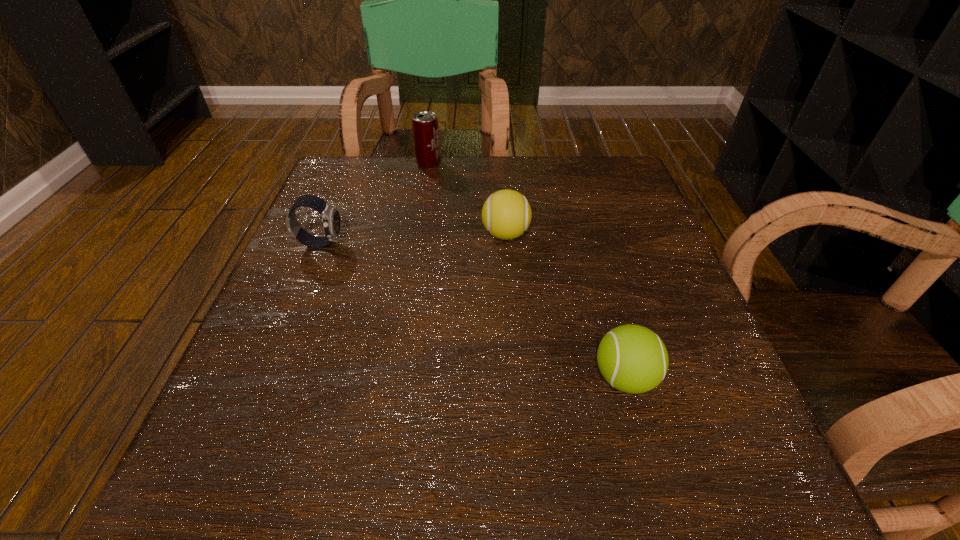
What are the coordinates of `beer can` in the screenshot? It's located at pos(425,127).

At what (x,y) coordinates should I click in order to perform the action: click on the farthest object. Please return your answer as a coordinate pair (x, y). This screenshot has height=540, width=960. Looking at the image, I should click on (425, 127).

Where is `the leftmost object`? Image resolution: width=960 pixels, height=540 pixels. the leftmost object is located at coordinates (330, 215).

Find the location of a particular element. the left tennis ball is located at coordinates (506, 214).

You are a GUI agent. You are given a task and a screenshot of the screen. Output one action in this format:
    pyautogui.click(x=<x>, y=<y>)
    Task: Click on the farther tennis ball
    This screenshot has width=960, height=540.
    Given the screenshot: What is the action you would take?
    pos(506,214)

The width and height of the screenshot is (960, 540). What are the coordinates of `the rightmost object` in the screenshot? It's located at (633, 359).

At what (x,y) coordinates should I click in order to perform the action: click on the nearest object. Please return your answer as a coordinate pair (x, y). This screenshot has height=540, width=960. Looking at the image, I should click on (633, 359).

Image resolution: width=960 pixels, height=540 pixels. I want to click on vacant space located 0.170m on the front of the beer can, so click(x=420, y=211).

At what (x,y) coordinates should I click in order to perform the action: click on free space located on the face of the watch. Please return your answer as a coordinate pair (x, y). The image size is (960, 540). Looking at the image, I should click on (485, 244).

Locate an element on the screen. The image size is (960, 540). free space located 0.370m on the left of the farther tennis ball is located at coordinates (299, 234).